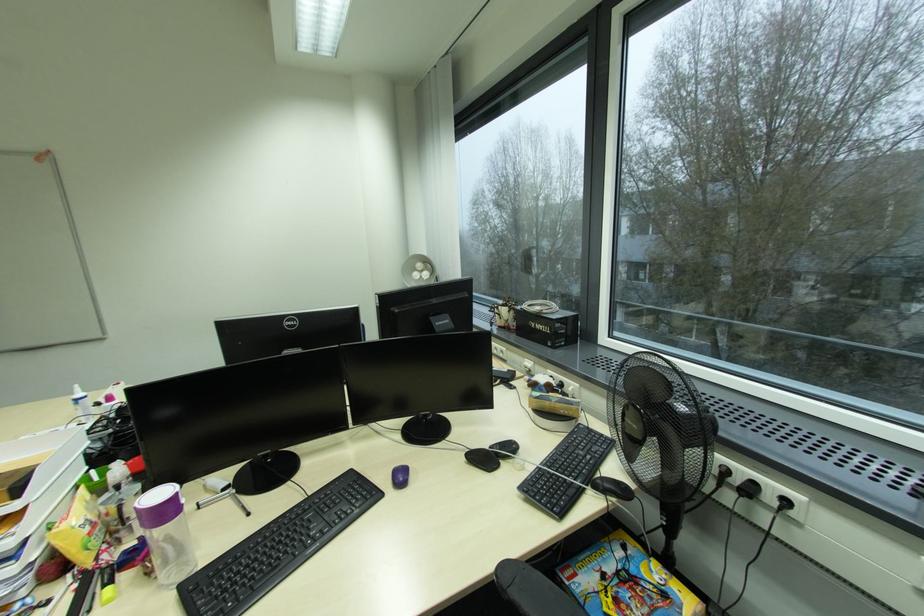
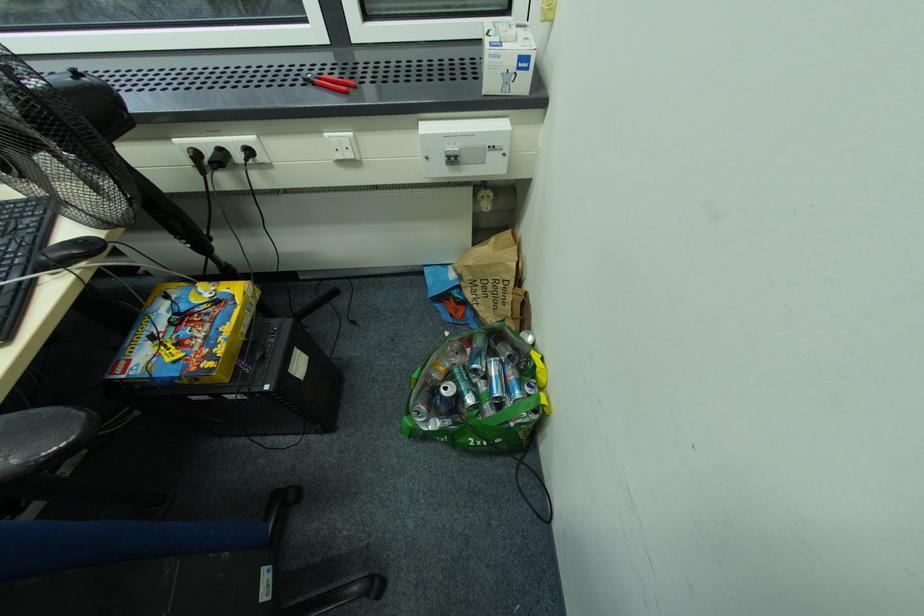
The first image is from the beginning of the video and the second image is from the end. How did the camera likely rotate when shooting the video?

The camera's rotation is toward right-down.